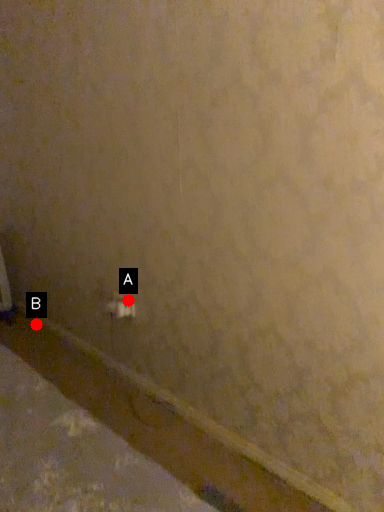
Question: Two points are circled on the image, labeled by A and B beside each circle. Which point is further to the camera?

Choices:
 (A) A is further
 (B) B is further

Answer: (B)